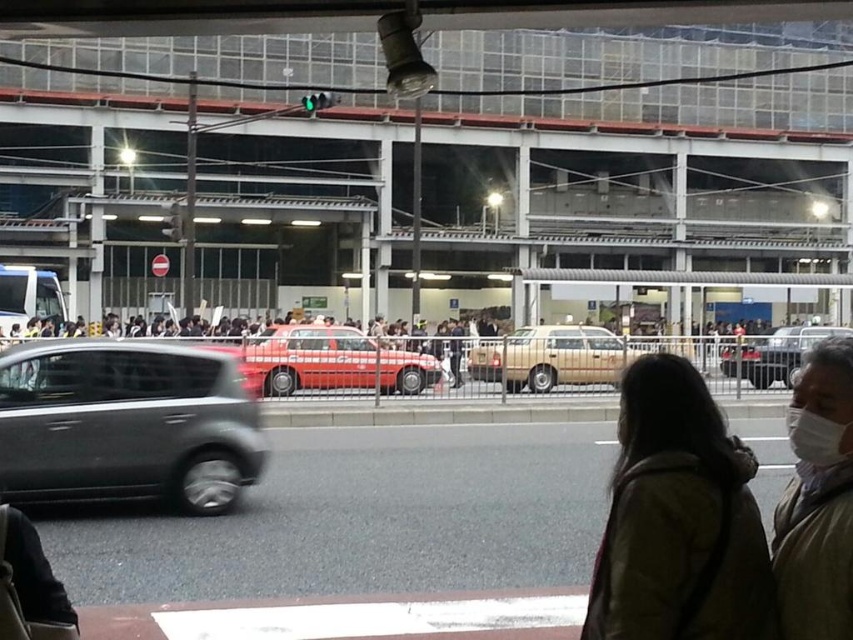
Question: From the image, what is the correct spatial relationship of satin black hatchback at left in relation to dark brown leather jacket at lower right?

Choices:
 (A) above
 (B) below

Answer: (B)

Question: Among these points, which one is nearest to the camera?

Choices:
 (A) (572, 333)
 (B) (776, 368)

Answer: (B)

Question: Can you confirm if dark brown leather jacket at lower right is thinner than shiny black sedan at center?

Choices:
 (A) yes
 (B) no

Answer: (A)

Question: Can you confirm if satin black hatchback at left is positioned to the right of light brown textured coat at lower right?

Choices:
 (A) yes
 (B) no

Answer: (B)

Question: Estimate the real-world distances between objects in this image. Which object is closer to the shiny red car at center?

Choices:
 (A) shiny black sedan at center
 (B) satin black hatchback at left

Answer: (A)

Question: Which of the following is the farthest from the observer?

Choices:
 (A) (833, 609)
 (B) (730, 579)
 (C) (88, 346)

Answer: (C)